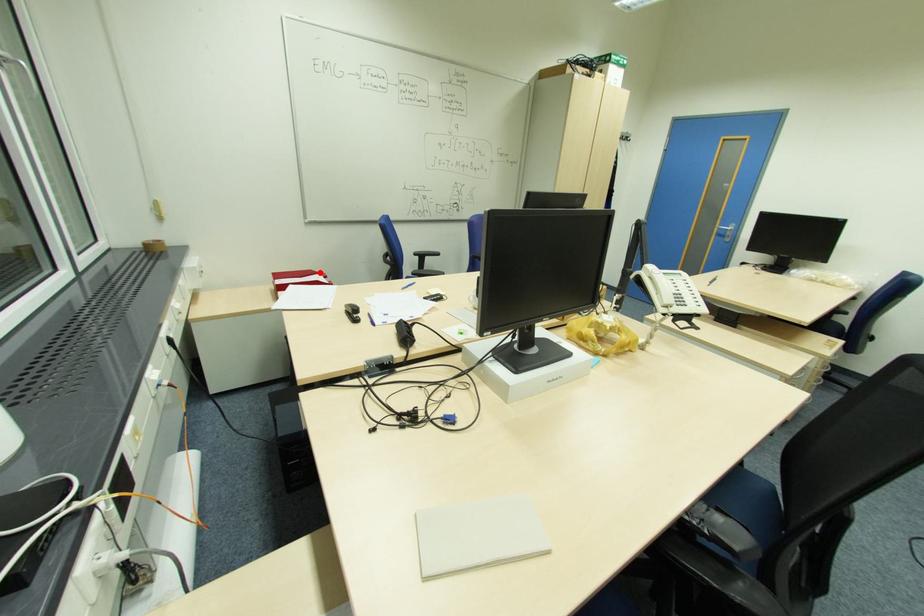
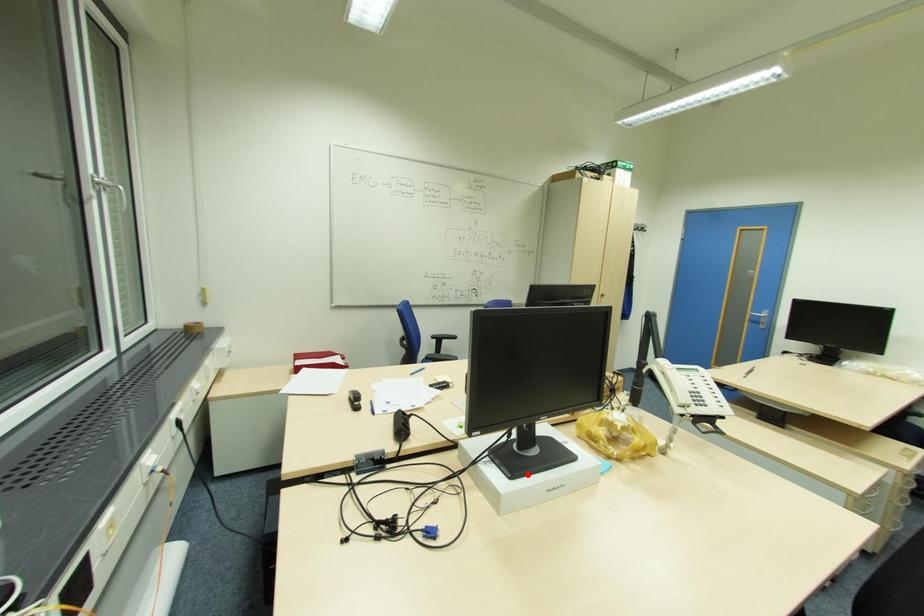
I am providing you with two images of the same scene from different viewpoints. A red point is marked on the first image and another point is marked on the second image. Is the marked point in image1 the same physical position as the marked point in image2?

No